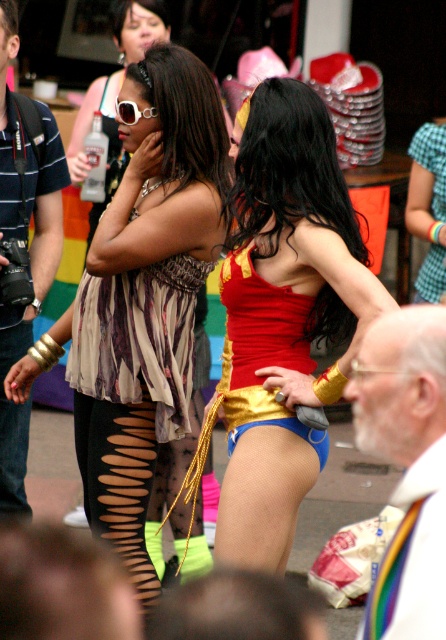
Is matte sheer tights at center shorter than black mesh tights at lower left?

No, matte sheer tights at center is not shorter than black mesh tights at lower left.

Image resolution: width=446 pixels, height=640 pixels. What do you see at coordinates (145, 296) in the screenshot?
I see `matte sheer tights at center` at bounding box center [145, 296].

Does point (152, 435) come farther from viewer compared to point (27, 344)?

No.

Locate an element on the screen. matte sheer tights at center is located at coordinates (145, 296).

Can you confirm if matte brown dress at center is positioned above shiny gold bikini at center?

Correct, matte brown dress at center is located above shiny gold bikini at center.

Find the location of `matte brown dress at center`. matte brown dress at center is located at coordinates (139, 337).

Image resolution: width=446 pixels, height=640 pixels. I want to click on matte brown dress at center, so coord(139,337).

Between matte sheer tights at center and white hair at upper right, which one appears on the left side from the viewer's perspective?

Positioned to the left is matte sheer tights at center.

Image resolution: width=446 pixels, height=640 pixels. What do you see at coordinates (145, 296) in the screenshot? I see `matte sheer tights at center` at bounding box center [145, 296].

Does point (176, 429) come farther from viewer compared to point (382, 362)?

Yes, point (176, 429) is behind point (382, 362).

Where is `matte sheer tights at center`? matte sheer tights at center is located at coordinates (145, 296).